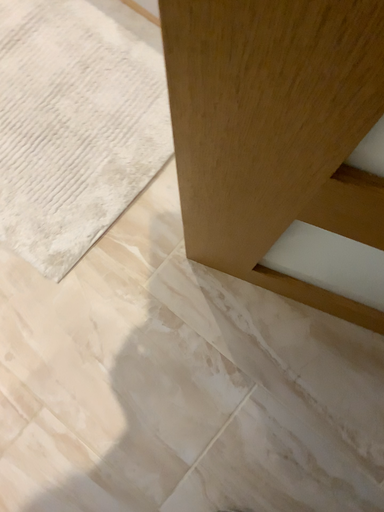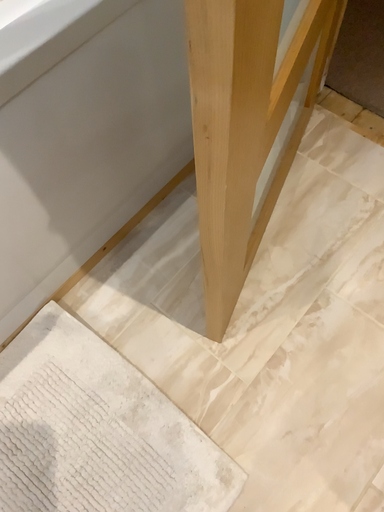
Question: How did the camera likely rotate when shooting the video?

Choices:
 (A) rotated right
 (B) rotated left

Answer: (A)